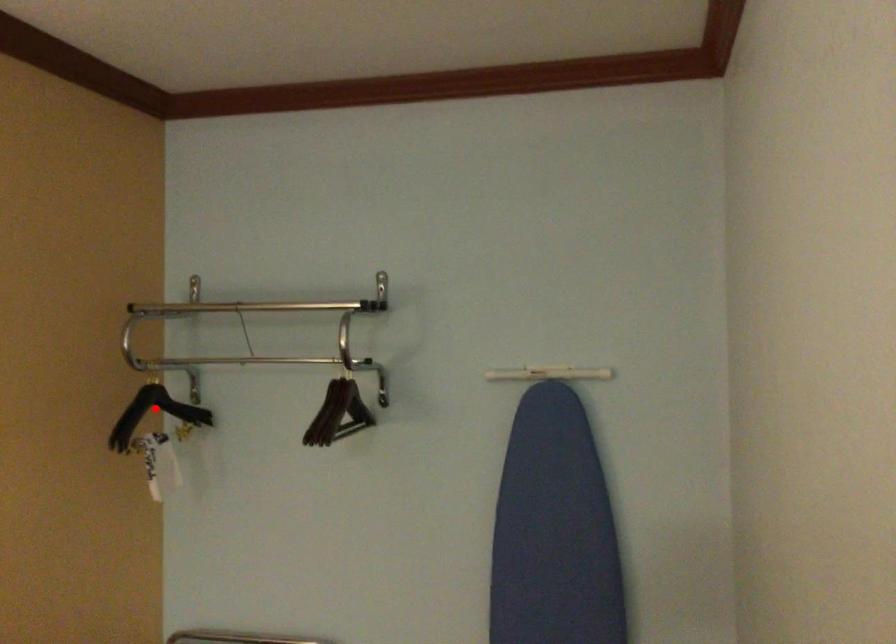
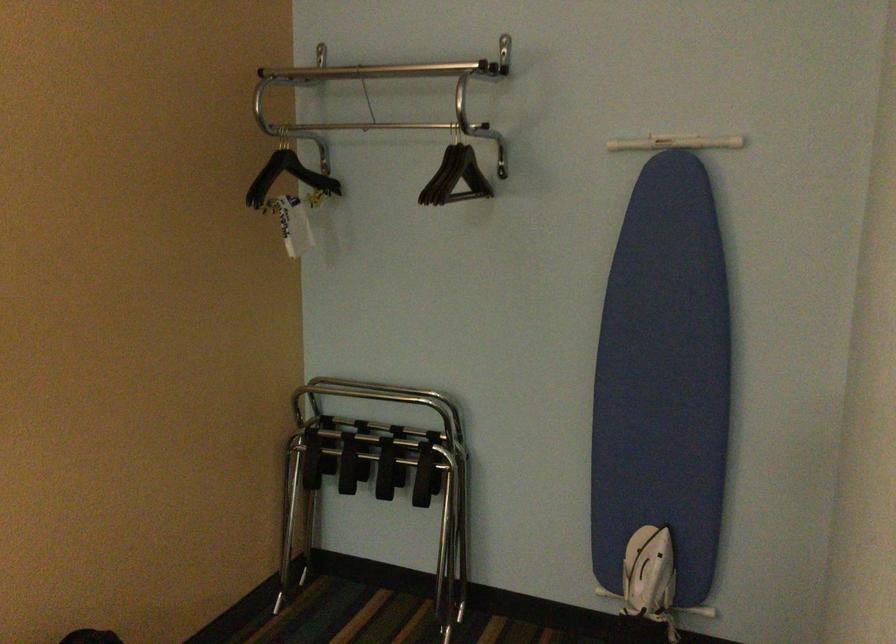
Question: I am providing you with two images of the same scene from different viewpoints. A red point is marked on the first image. At the location where the point appears in image 1, is it still visible in image 2?

Choices:
 (A) Yes
 (B) No

Answer: (A)